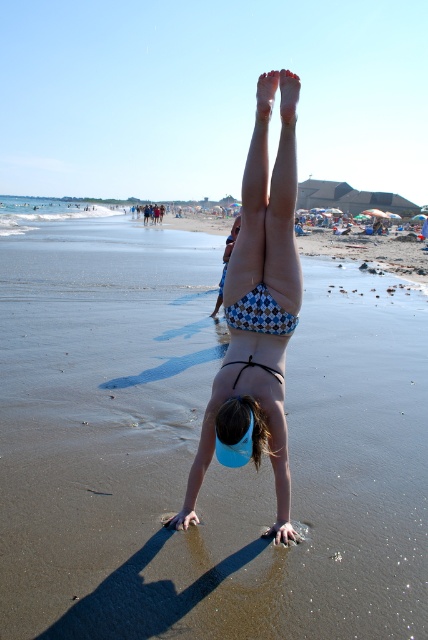
You are a photographer trying to capture the white checkered bikini at center and the clear blue water at lower left in the same frame. Based on their positions, which object is located to the left of the other?

The clear blue water at lower left is positioned to the left of the white checkered bikini at center.

From the picture: You are a photographer at the beach and want to capture a wide shot of the scene. You notice the white checkered bikini at center and the clear blue water at lower left. Which object should you focus on first if you want to include both in your frame without zooming in?

The white checkered bikini at center is narrower than the clear blue water at lower left, so focusing on the white checkered bikini at center first would allow you to frame both objects without needing to zoom in.